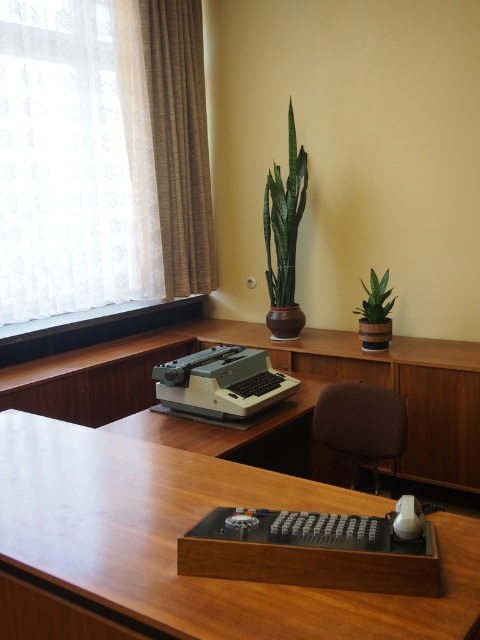
Question: Is wooden desk at center thinner than brown fabric chair at center?

Choices:
 (A) yes
 (B) no

Answer: (B)

Question: Does white sheer curtain at upper left have a smaller size compared to green glossy plant at upper center?

Choices:
 (A) yes
 (B) no

Answer: (B)

Question: Which of these objects is positioned closest to the matte plastic typewriter at center?

Choices:
 (A) wooden desk at center
 (B) beige fabric curtain at upper left

Answer: (A)

Question: Considering the real-world distances, which object is closest to the green matte plant at upper right?

Choices:
 (A) brown fabric chair at center
 (B) beige fabric curtain at upper left

Answer: (A)

Question: Does white sheer curtain at upper left appear on the right side of matte plastic typewriter at center?

Choices:
 (A) yes
 (B) no

Answer: (B)

Question: Which of the following is the farthest from the observer?

Choices:
 (A) (75, 442)
 (B) (297, 451)
 (C) (153, 176)

Answer: (C)